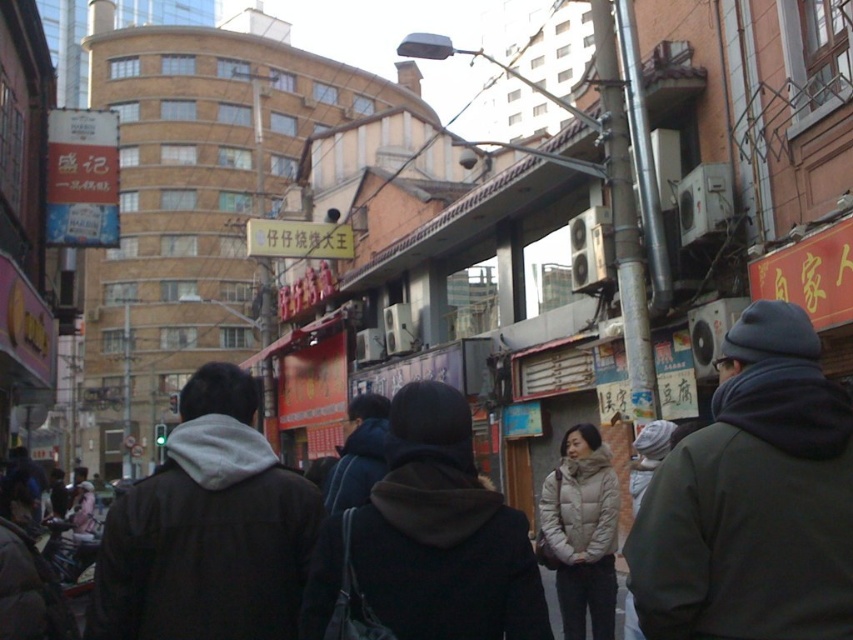
Question: Which of these objects is positioned closest to the black fuzzy jacket at center?

Choices:
 (A) white down jacket at center
 (B) dark gray knit hat at upper right

Answer: (B)

Question: Is black fuzzy jacket at center thinner than white down jacket at center?

Choices:
 (A) yes
 (B) no

Answer: (B)

Question: Which point is closer to the camera?

Choices:
 (A) (564, 468)
 (B) (442, 554)

Answer: (B)

Question: From the image, what is the correct spatial relationship of dark gray hoodie at center in relation to black fuzzy jacket at center?

Choices:
 (A) left
 (B) right

Answer: (A)

Question: From the image, what is the correct spatial relationship of black fuzzy jacket at center in relation to white down jacket at center?

Choices:
 (A) below
 (B) above

Answer: (B)

Question: Which point is closer to the camera?

Choices:
 (A) (451, 493)
 (B) (833, 493)
 (C) (238, 449)
 (D) (560, 445)

Answer: (B)